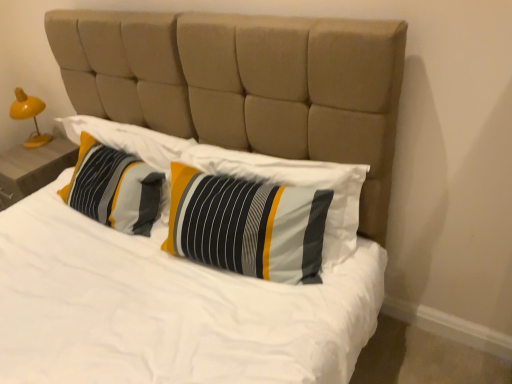
Where is `spots to the right of yellow plastic lamp at left`? spots to the right of yellow plastic lamp at left is located at coordinates (58, 142).